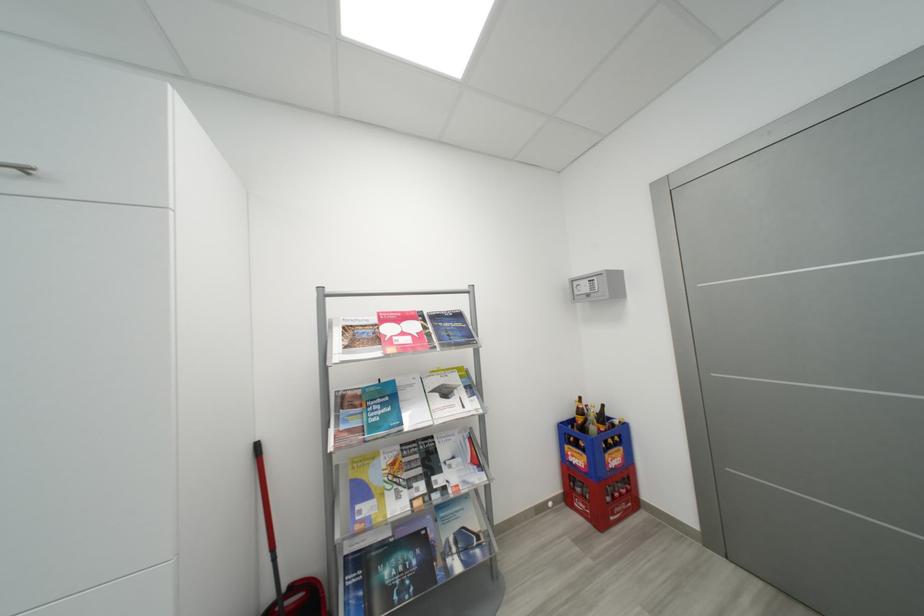
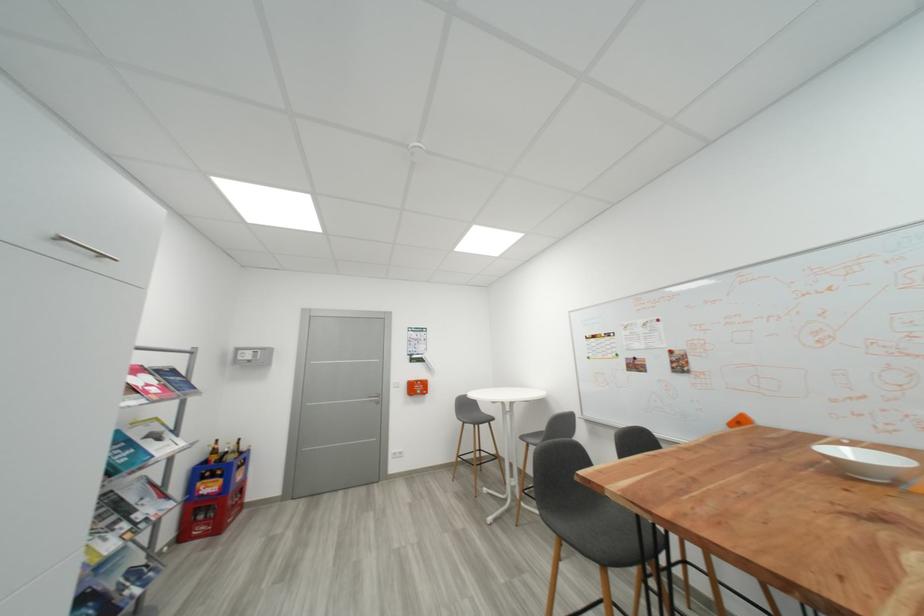
Where in the second image is the point corresponding to pixel 575 501 from the first image?

(189, 538)